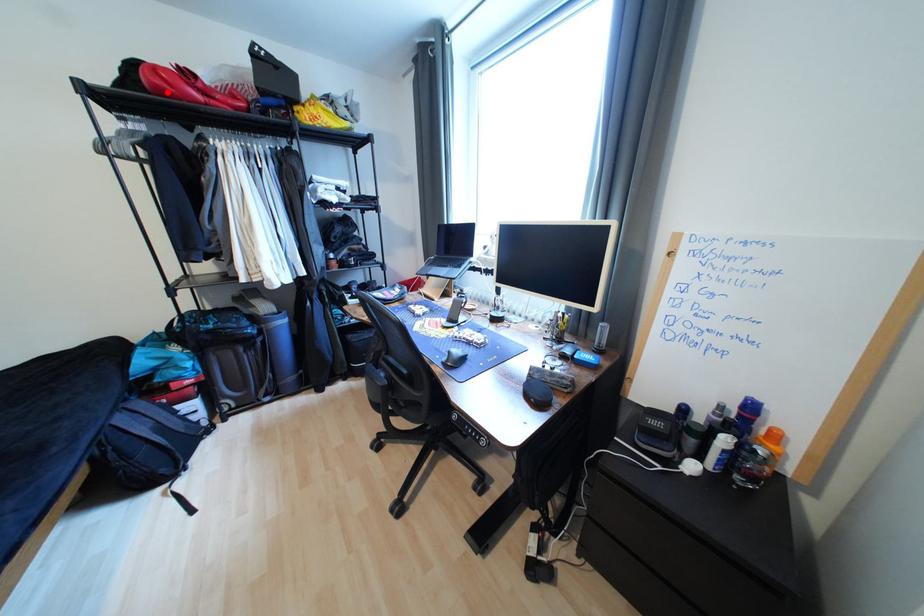
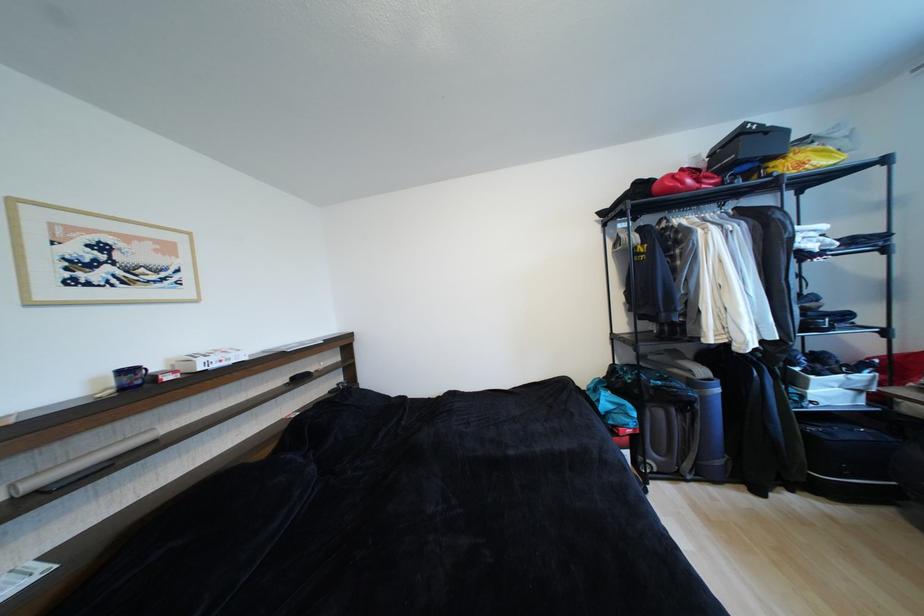
Question: I am providing you with two images of the same scene from different viewpoints. A red point is marked on the first image. At the location where the point appears in image 1, is it still visible in image 2?

Choices:
 (A) Yes
 (B) No

Answer: (A)